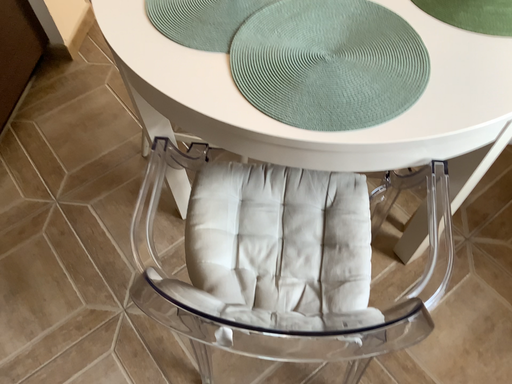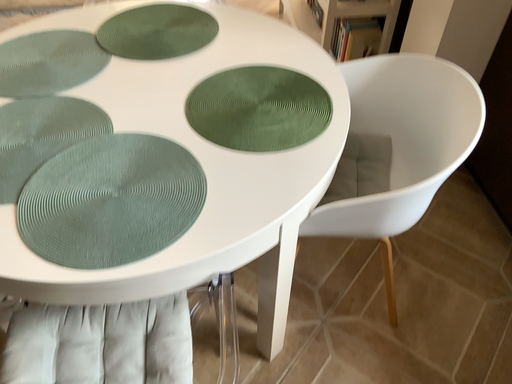
Question: How did the camera likely rotate when shooting the video?

Choices:
 (A) rotated right
 (B) rotated left

Answer: (A)